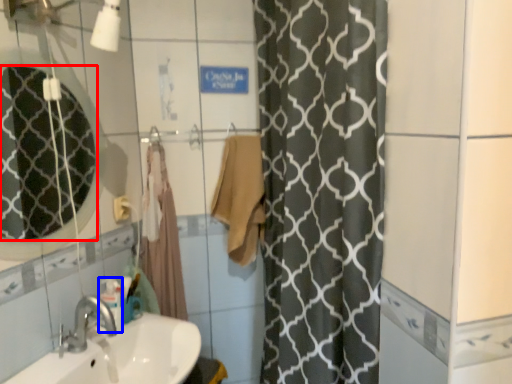
Question: Which of the following is the closest to the observer, mirror (highlighted by a red box) or toiletry (highlighted by a blue box)?

Choices:
 (A) mirror
 (B) toiletry

Answer: (A)